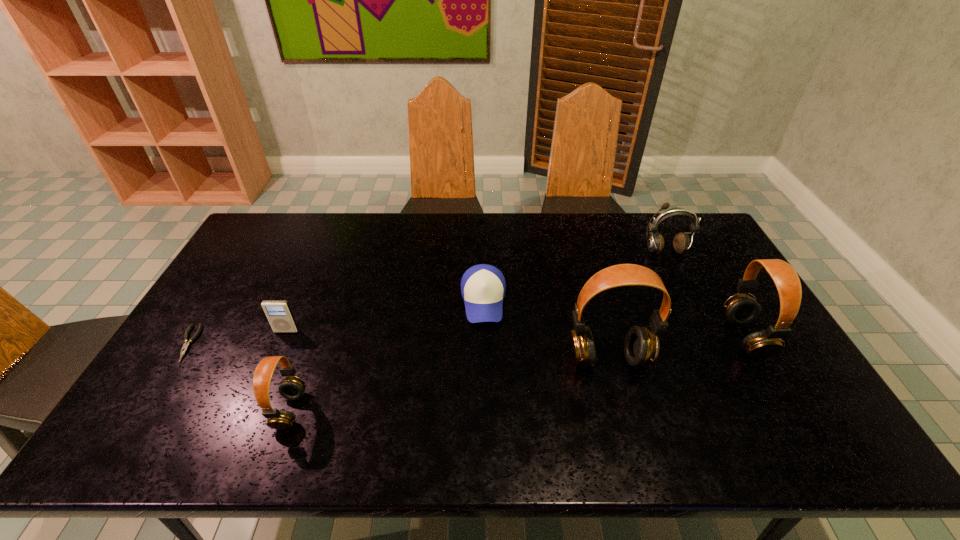
To achieve uniform spacing by inserting another headset among them, please point to a free space for this new headset. Please provide its 2D coordinates. Your answer should be formatted as a tuple, i.e. [(x, y)], where the tuple contains the x and y coordinates of a point satisfying the conditions above.

[(458, 383)]